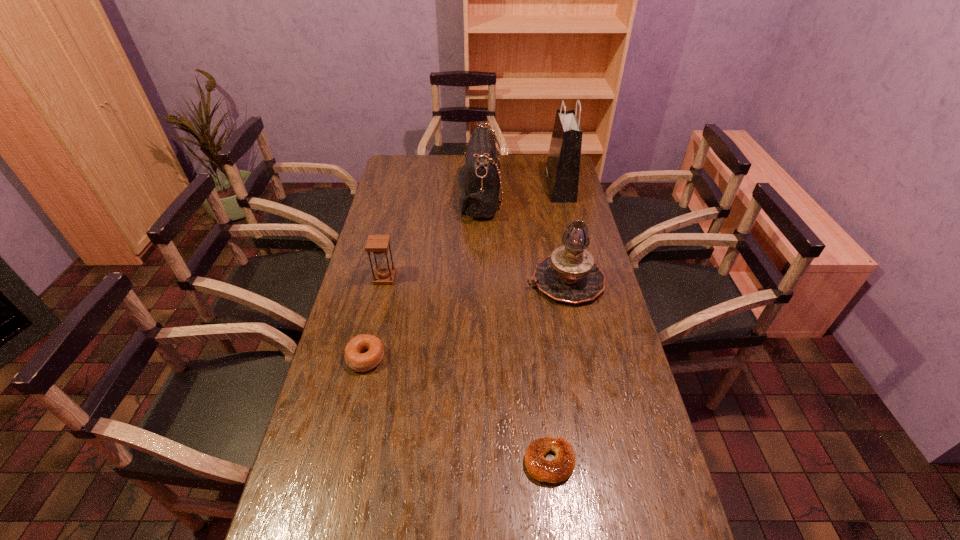
Where is `vacant space in between the shortest object and the hourglass`? vacant space in between the shortest object and the hourglass is located at coordinates (468, 370).

At what (x,y) coordinates should I click in order to perform the action: click on vacant area between the fifth farthest object and the shortest object. Please return your answer as a coordinate pair (x, y). This screenshot has width=960, height=540. Looking at the image, I should click on (458, 410).

This screenshot has width=960, height=540. I want to click on free point between the tallest object and the fifth farthest object, so click(x=463, y=273).

Image resolution: width=960 pixels, height=540 pixels. What are the coordinates of `object that is the closest one to the left bagel` in the screenshot? It's located at (378, 244).

You are a GUI agent. You are given a task and a screenshot of the screen. Output one action in this format:
    pyautogui.click(x=<x>, y=<y>)
    Task: Click on the object that is the third closest to the shortest object
    
    Given the screenshot: What is the action you would take?
    pyautogui.click(x=378, y=244)

Select which bagel appears as the second closest to the shopping bag. Please provide its 2D coordinates. Your answer should be formatted as a tuple, i.e. [(x, y)], where the tuple contains the x and y coordinates of a point satisfying the conditions above.

[(560, 468)]

Find the location of `free region that satisfies the following two spatial constraints: 1. at the front of the third object from left to right with chain and zipper; 2. on the right side of the shortest object`. free region that satisfies the following two spatial constraints: 1. at the front of the third object from left to right with chain and zipper; 2. on the right side of the shortest object is located at coordinates (479, 462).

I want to click on free point that satisfies the following two spatial constraints: 1. at the front of the handbag with chain and zipper; 2. on the left side of the oil lamp, so click(x=480, y=281).

The width and height of the screenshot is (960, 540). I want to click on blank area in the image that satisfies the following two spatial constraints: 1. on the front side of the fourth tallest object; 2. on the left side of the shorter bagel, so click(343, 462).

Identify the location of vacant space that satisfies the following two spatial constraints: 1. on the front with handles of the tallest object; 2. on the front side of the fourth tallest object. (583, 278).